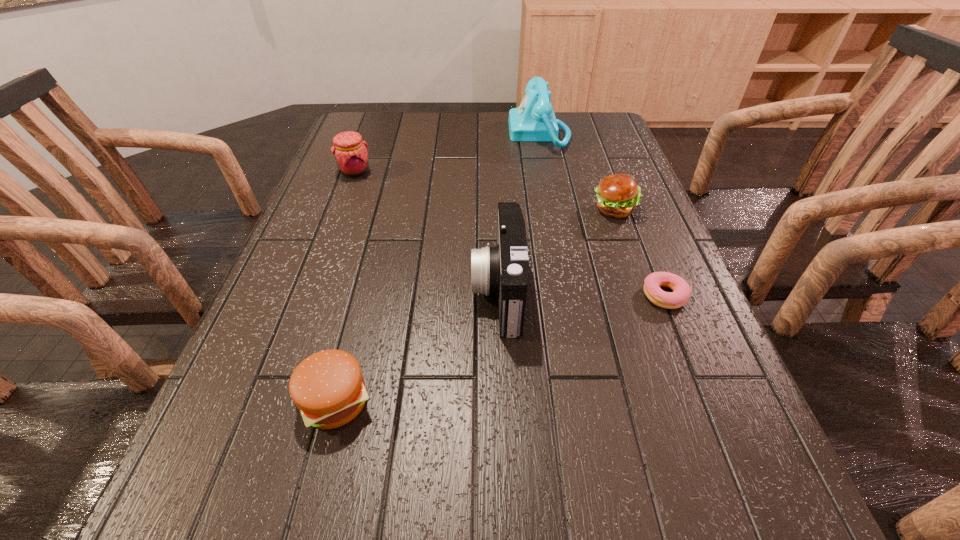
Where is `vacant space positioned 0.160m on the dial of the farthest object`? The height and width of the screenshot is (540, 960). vacant space positioned 0.160m on the dial of the farthest object is located at coordinates (459, 133).

At what (x,y) coordinates should I click in order to perform the action: click on vacant space located 0.190m on the dial of the farthest object. Please return your answer as a coordinate pair (x, y). The image size is (960, 540). Looking at the image, I should click on (449, 133).

At what (x,y) coordinates should I click in order to perform the action: click on free location located 0.250m on the lens of the third object from left to right. Please return your answer as a coordinate pair (x, y). This screenshot has height=540, width=960. Looking at the image, I should click on (350, 292).

Where is `free space located 0.070m on the lens of the third object from left to right`? free space located 0.070m on the lens of the third object from left to right is located at coordinates (438, 292).

You are a GUI agent. You are given a task and a screenshot of the screen. Output one action in this format:
    pyautogui.click(x=<x>, y=<y>)
    Task: Click on the free location located 0.080m on the lens of the third object from left to right
    The image size is (960, 540).
    Given the screenshot: What is the action you would take?
    point(433,292)

Locate an element on the screen. vacant region located on the front of the jam is located at coordinates (340, 211).

You are a GUI agent. You are given a task and a screenshot of the screen. Output one action in this format:
    pyautogui.click(x=<x>, y=<y>)
    Task: Click on the vacant region located 0.060m on the back of the third farthest object
    This screenshot has width=960, height=540.
    Given the screenshot: What is the action you would take?
    pyautogui.click(x=605, y=183)

Identify the location of vacant position located 0.060m on the left of the nearer hamburger. point(259,401).

At what (x,y) coordinates should I click in order to perform the action: click on vacant space situated on the left of the shortest object. Please return your answer as a coordinate pair (x, y). The width and height of the screenshot is (960, 540). Looking at the image, I should click on (457, 295).

This screenshot has width=960, height=540. Identify the location of object located at the far edge. (534, 120).